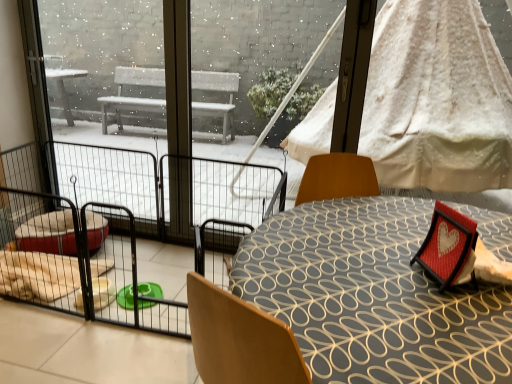
Question: Considering the positions of white textured fabric canopy bed at upper right and red fabric heart frame at lower right in the image, is white textured fabric canopy bed at upper right wider or thinner than red fabric heart frame at lower right?

Choices:
 (A) thin
 (B) wide

Answer: (A)

Question: From a real-world perspective, is white textured fabric canopy bed at upper right positioned above or below red fabric heart frame at lower right?

Choices:
 (A) below
 (B) above

Answer: (B)

Question: Based on their relative distances, which object is nearer to the red fabric heart frame at lower right?

Choices:
 (A) white textured fabric canopy bed at upper right
 (B) patterned fabric table at center
 (C) black wire mesh at left
 (D) transparent glass door at upper left

Answer: (B)

Question: Estimate the real-world distances between objects in this image. Which object is farther from the white textured fabric canopy bed at upper right?

Choices:
 (A) red fabric heart frame at lower right
 (B) black wire mesh at left
 (C) patterned fabric table at center
 (D) transparent glass door at upper left

Answer: (D)